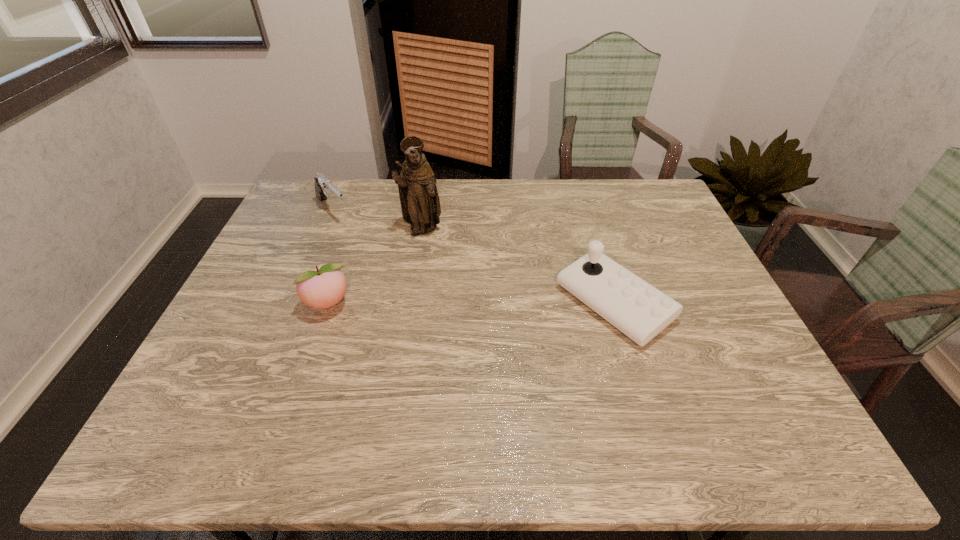
This screenshot has width=960, height=540. Identify the location of empty space that is in between the rightmost object and the third object from left to right. [x=517, y=267].

I want to click on vacant area between the figurine and the peach, so pyautogui.click(x=374, y=267).

In order to click on vacant space in between the rightmost object and the gun in this screenshot , I will do click(473, 256).

Where is `the second closest object to the rightmost object`? The width and height of the screenshot is (960, 540). the second closest object to the rightmost object is located at coordinates (325, 286).

Choose which object is the third nearest neighbor to the peach. Please provide its 2D coordinates. Your answer should be formatted as a tuple, i.e. [(x, y)], where the tuple contains the x and y coordinates of a point satisfying the conditions above.

[(640, 311)]

This screenshot has height=540, width=960. I want to click on free space that satisfies the following two spatial constraints: 1. on the back side of the figurine; 2. on the left side of the peach, so [354, 230].

Where is `vacant space that satisfies the following two spatial constraints: 1. on the front side of the rightmost object; 2. on the right side of the gun`? Image resolution: width=960 pixels, height=540 pixels. vacant space that satisfies the following two spatial constraints: 1. on the front side of the rightmost object; 2. on the right side of the gun is located at coordinates (293, 303).

You are a GUI agent. You are given a task and a screenshot of the screen. Output one action in this format:
    pyautogui.click(x=<x>, y=<y>)
    Task: Click on the vacant space that satisfies the following two spatial constraints: 1. on the front side of the figurine; 2. on the left side of the rightmost object
    
    Given the screenshot: What is the action you would take?
    click(410, 303)